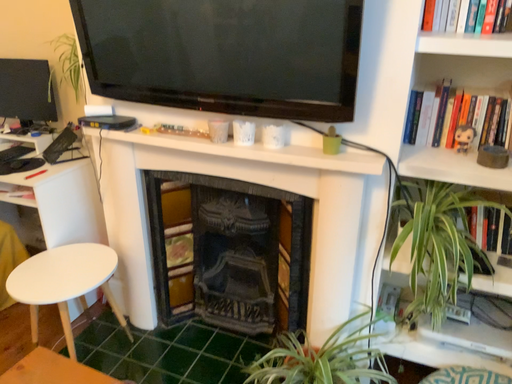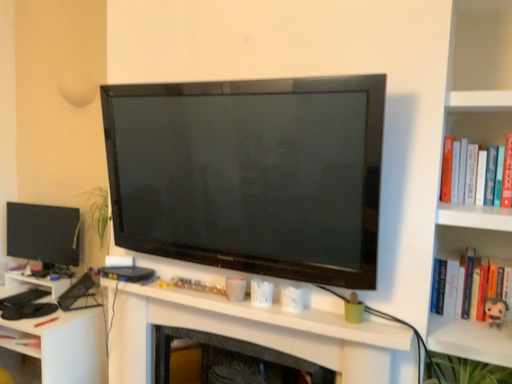
Question: Which way did the camera rotate in the video?

Choices:
 (A) rotated downward
 (B) rotated upward

Answer: (B)